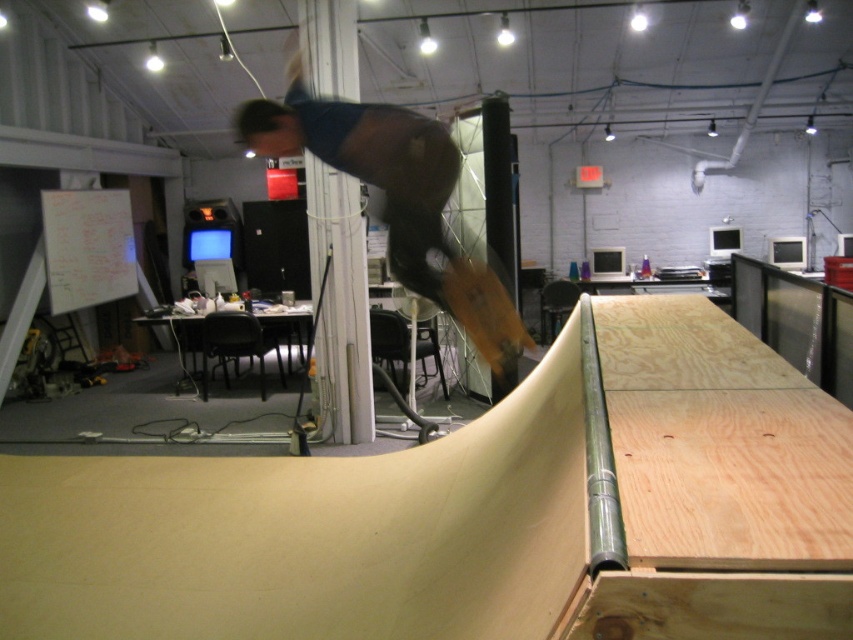
You are organizing a space in an office where there is a brown leather jacket at center and a wooden skateboard at center. You need to place both items on a shelf that can only hold one of them. Which item should you choose based on their sizes?

The brown leather jacket at center has a larger size compared to the wooden skateboard at center, so you should choose the brown leather jacket at center to place on the shelf since it requires more space.